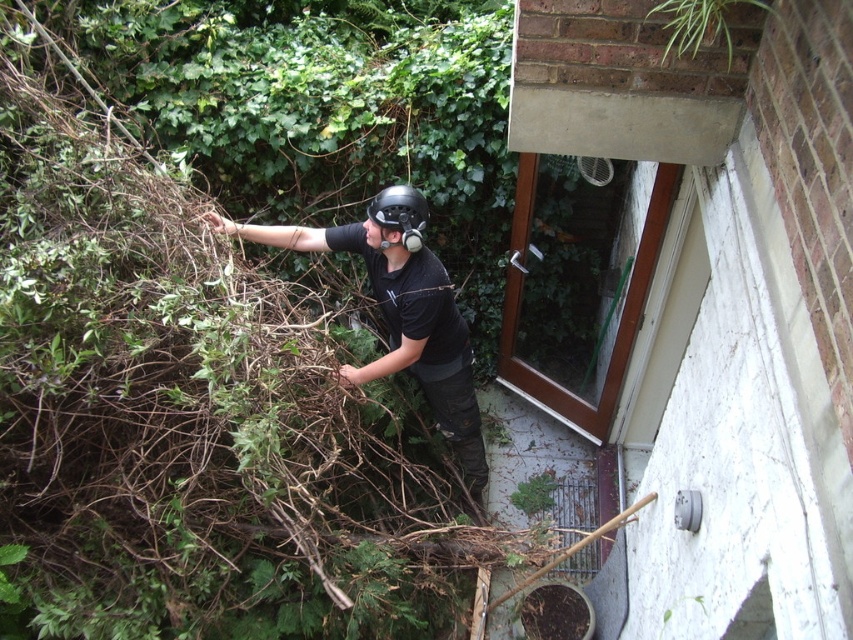
Can you confirm if black matte helmet at upper left is positioned above matte black helmet at center?

Actually, black matte helmet at upper left is below matte black helmet at center.

Where is `black matte helmet at upper left`? black matte helmet at upper left is located at coordinates (402, 326).